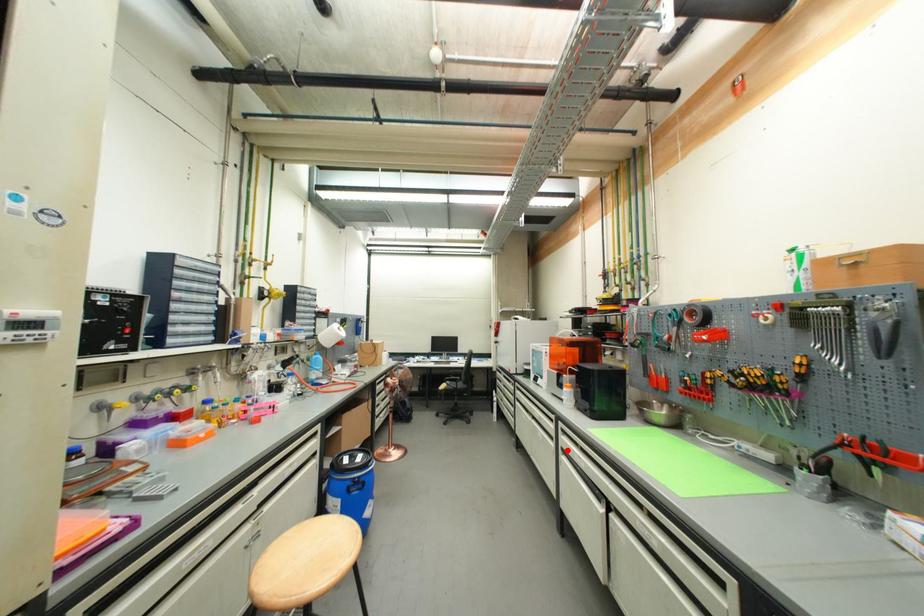
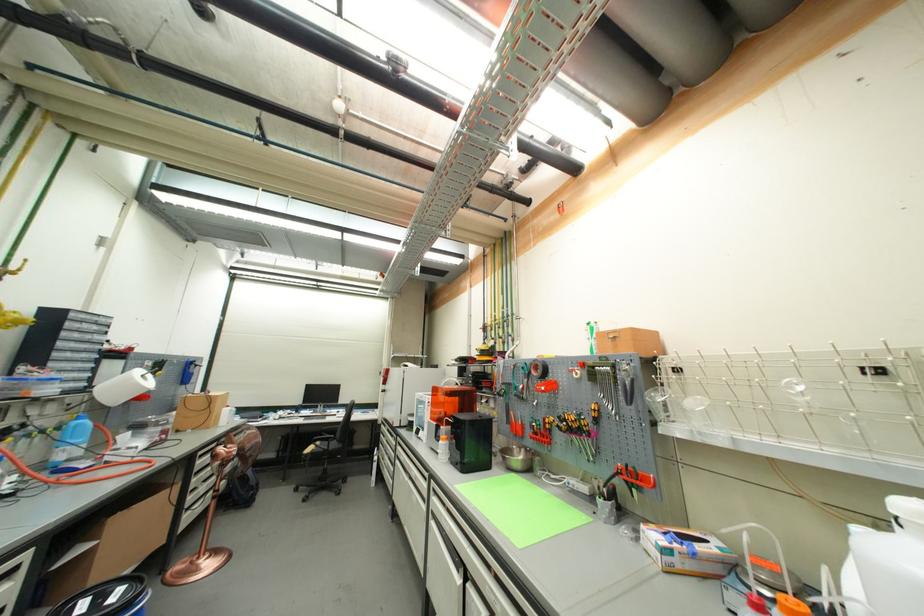
Find the pixel in the second image that matches the highlighted location in the first image.

(438, 513)